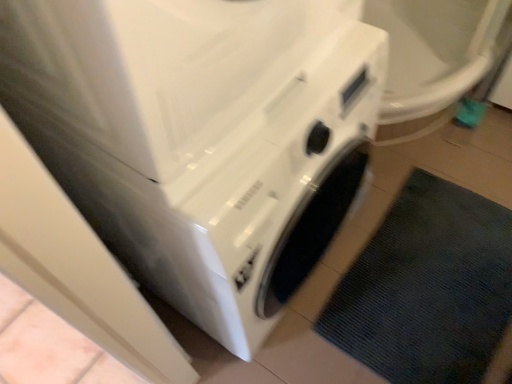
What are the coordinates of `empty space that is ontop of dark gray textured bath mat at lower right (from a real-world perspective)` in the screenshot? It's located at (435, 274).